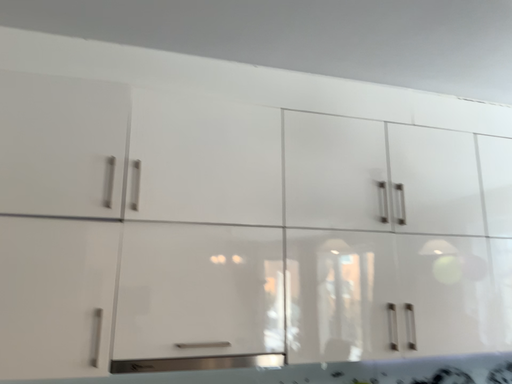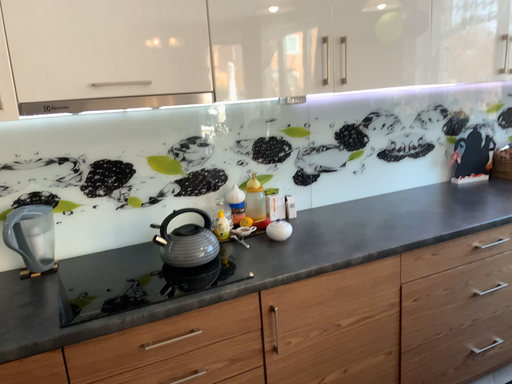
Question: How did the camera likely rotate when shooting the video?

Choices:
 (A) rotated left
 (B) rotated right

Answer: (B)